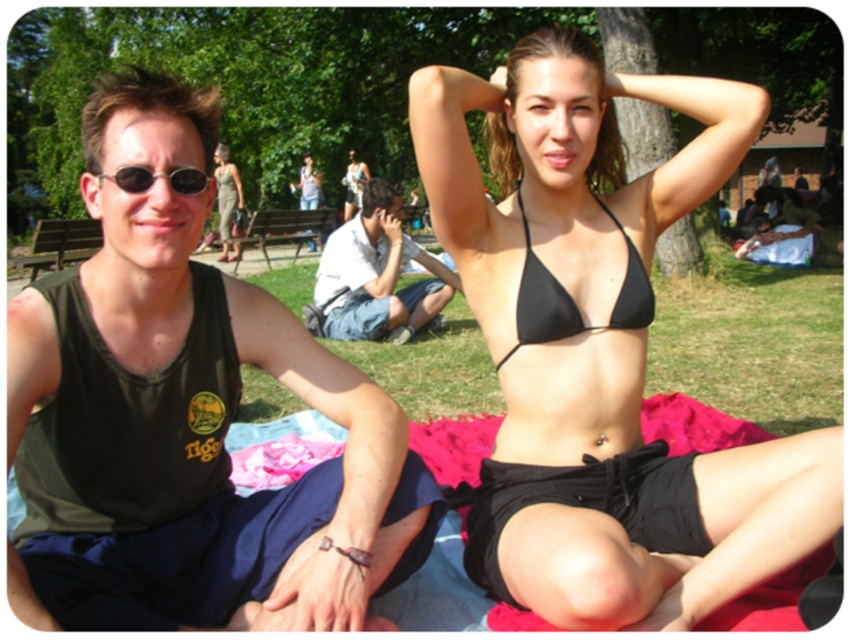
Question: Which of the following is the closest to the observer?

Choices:
 (A) black matte bikini top at upper center
 (B) green grass at center
 (C) black matte bikini top at center

Answer: (A)

Question: Which point appears farthest from the camera in this image?

Choices:
 (A) (144, 180)
 (B) (439, 280)
 (C) (534, 314)
 (D) (583, 122)

Answer: (B)

Question: Considering the real-world distances, which object is closest to the sunglasses at left?

Choices:
 (A) black matte bikini top at upper center
 (B) black matte bikini top at center
 (C) green grass at center
 (D) dark green tank top at left

Answer: (D)

Question: Can you confirm if dark green tank top at left is positioned above green grass at center?

Choices:
 (A) no
 (B) yes

Answer: (B)

Question: Can you confirm if dark green tank top at left is positioned to the left of black matte bikini top at center?

Choices:
 (A) yes
 (B) no

Answer: (A)

Question: Is dark green tank top at left bigger than green grass at center?

Choices:
 (A) yes
 (B) no

Answer: (A)